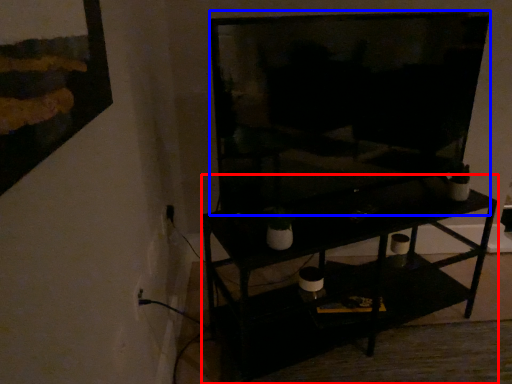
Question: Which object appears farthest to the camera in this image, shelf (highlighted by a red box) or television (highlighted by a blue box)?

Choices:
 (A) shelf
 (B) television

Answer: (A)